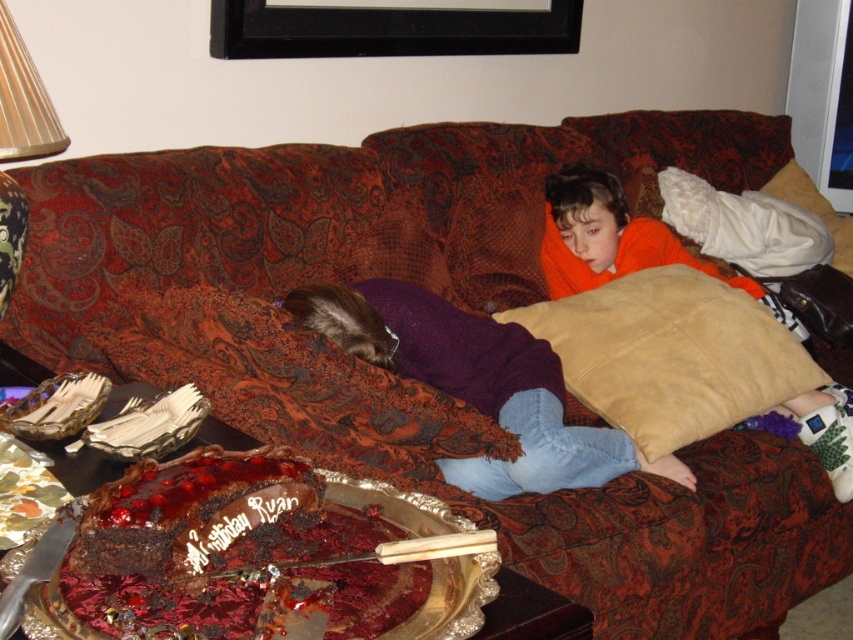
You are a guest at a party and want to grab a piece of the chocolateshinycake at lower left. From your current position, which direction should you move to reach it?

The chocolateshinycake at lower left is located at point [206,538], so you should move towards the lower left direction to reach it.

You are a delivery robot with a package that measures 1.2 meters in length. You need to place it on the floor between the suede beige pillow at center and the black wood picture frame at upper center. Is there enough space for the package to fit between them?

The distance between the suede beige pillow at center and the black wood picture frame at upper center is 1.08 meters. Since the package is 1.2 meters long, it is longer than the available space, so it won not fit between them.

You are a photographer trying to take a picture of the suede beige pillow at center and the black wood picture frame at upper center. To avoid shadows, you need to ensure that neither object is blocking the light source. Based on their positions, which object is more likely casting a shadow on the other?

The black wood picture frame at upper center is positioned above the suede beige pillow at center, so it might be casting a shadow on the pillow depending on the light direction.